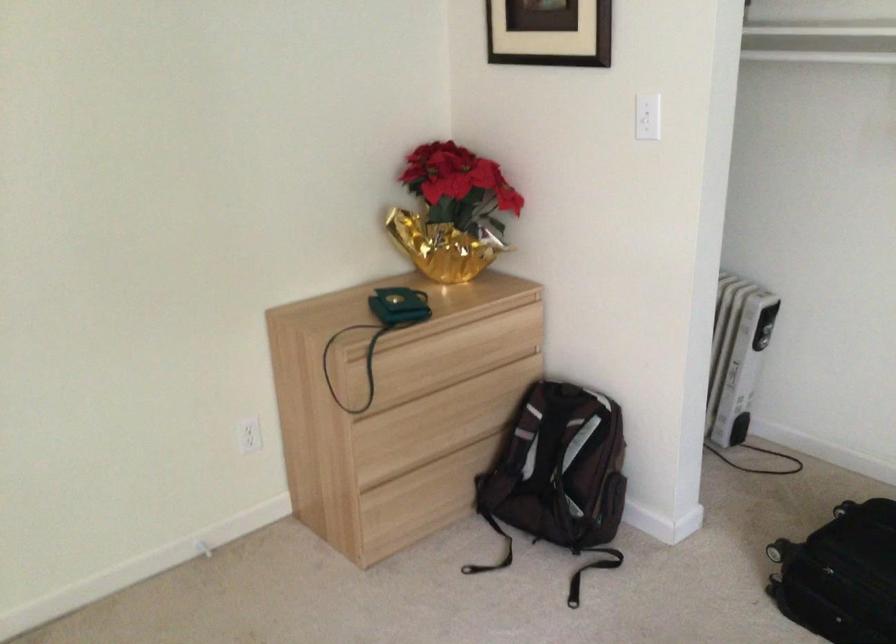
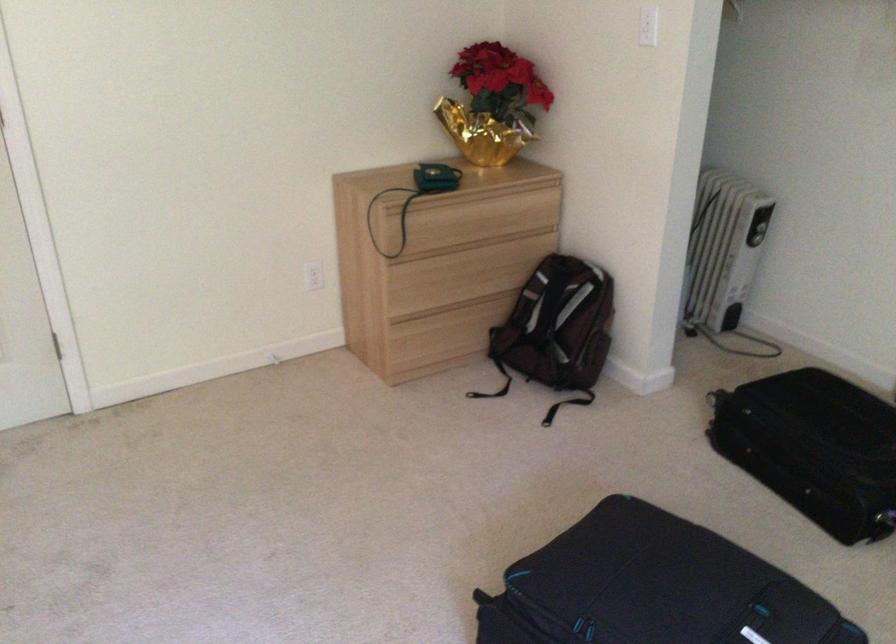
In the second image, find the point that corresponds to the point at 454,212 in the first image.

(493, 104)